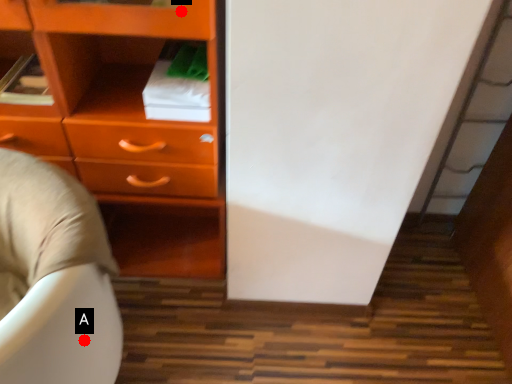
Question: Two points are circled on the image, labeled by A and B beside each circle. Which point is closer to the camera?

Choices:
 (A) A is closer
 (B) B is closer

Answer: (B)